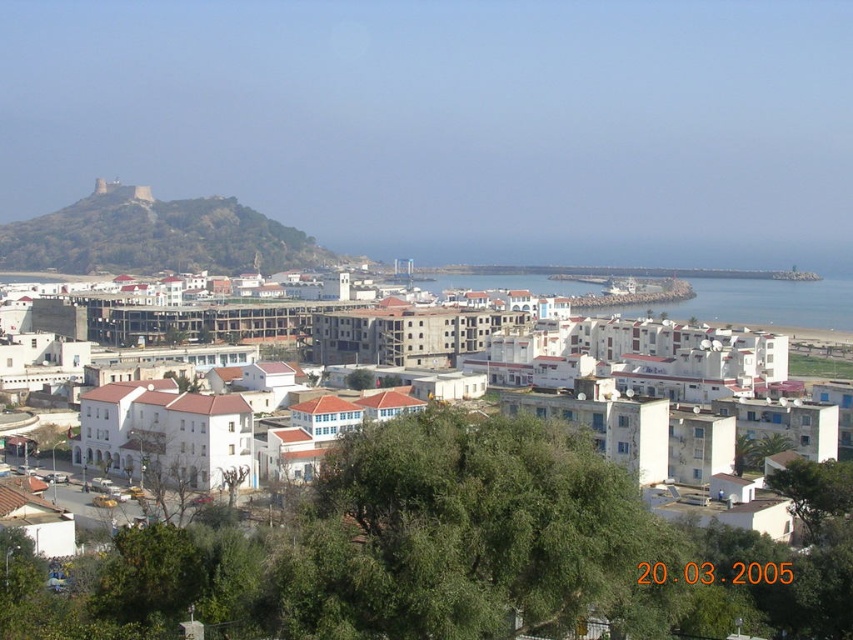
You are a tourist standing at the edge of the coastal town, looking out towards the sea. You notice the brown rocky hillside at upper left and the blue water at center. Which object is positioned to the left of the other?

The brown rocky hillside at upper left is to the left of blue water at center.

You are a tourist standing at the edge of the coastal town, looking out towards the sea. You see the white matte building at center and the blue water at center. Which object is located to the left of the other?

The white matte building at center is positioned on the left side of blue water at center, so the white matte building at center is to the left of the blue water at center.

You are a tourist standing at the entrance of the coastal town. You want to take a photo of the white matte building at center without any obstructions. Is the brown rocky hillside at upper left blocking your view of it?

The white matte building at center is behind the brown rocky hillside at upper left, so the hillside is blocking the view of the building. To capture an unobstructed photo, you would need to position yourself where the building is no longer behind the hillside.